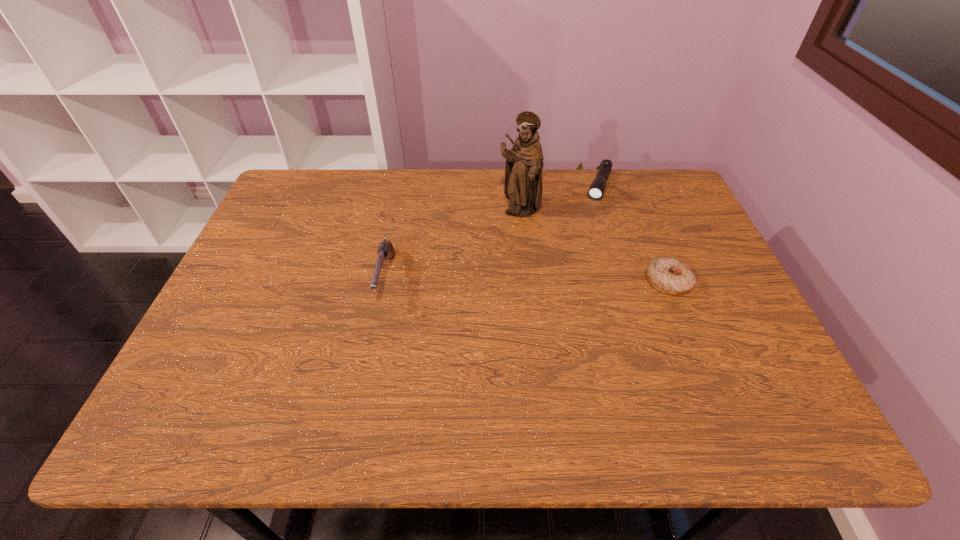
In the image, there is a desktop. Where is `vacant space at the right edge`? This screenshot has height=540, width=960. vacant space at the right edge is located at coordinates (742, 318).

The width and height of the screenshot is (960, 540). I want to click on free space at the far right corner, so click(x=626, y=184).

Identify the location of blank region between the leftmost object and the doughnut. (527, 280).

Identify the location of free space between the doughnut and the figurine. This screenshot has height=540, width=960. (593, 247).

This screenshot has height=540, width=960. I want to click on vacant area that lies between the gun and the flashlight, so click(x=492, y=232).

This screenshot has height=540, width=960. Find the location of `free space between the flashlight and the tallest object`. free space between the flashlight and the tallest object is located at coordinates coord(559,199).

What are the coordinates of `free space between the gun and the flashlight` in the screenshot? It's located at (492, 232).

Where is `free space between the flashlight and the doughnut`? free space between the flashlight and the doughnut is located at coordinates (634, 233).

The width and height of the screenshot is (960, 540). Find the location of `unoccupied area between the leftmost object and the flashlight`. unoccupied area between the leftmost object and the flashlight is located at coordinates [492, 232].

Identify the location of free spot between the doughnut and the tallest object. This screenshot has height=540, width=960. (593, 247).